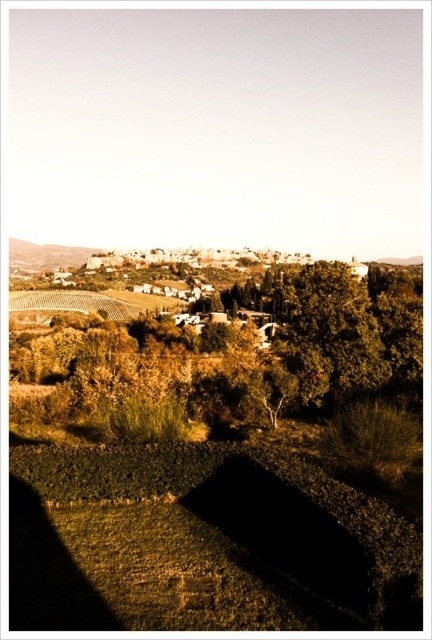
Question: Is green leafy tree at center below earthy brown stone wall at upper left?

Choices:
 (A) yes
 (B) no

Answer: (A)

Question: Which point is farther to the camera?

Choices:
 (A) earthy brown stone wall at upper left
 (B) green leafy tree at center

Answer: (A)

Question: Which of the following is the farthest from the observer?

Choices:
 (A) earthy brown stone wall at upper left
 (B) green leafy tree at center

Answer: (A)

Question: Is green leafy tree at center above earthy brown stone wall at upper left?

Choices:
 (A) yes
 (B) no

Answer: (B)

Question: Is green leafy tree at center above earthy brown stone wall at upper left?

Choices:
 (A) yes
 (B) no

Answer: (B)